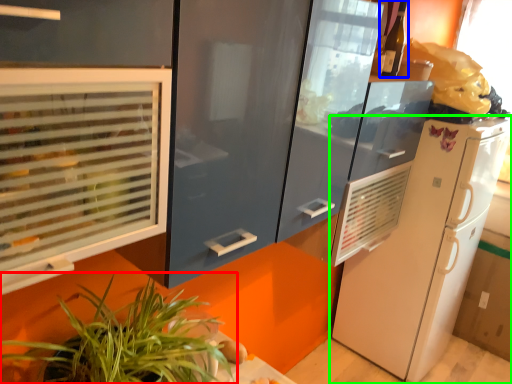
Question: Which is nearer to the houseplant (highlighted by a red box)? wine bottle (highlighted by a blue box) or refrigerator (highlighted by a green box).

Choices:
 (A) wine bottle
 (B) refrigerator

Answer: (A)